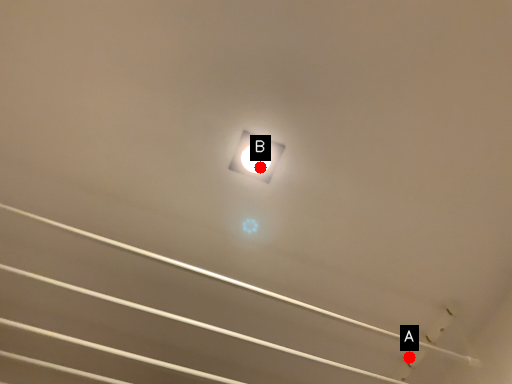
Question: Two points are circled on the image, labeled by A and B beside each circle. Which point is farther from the camera taking this photo?

Choices:
 (A) A is further
 (B) B is further

Answer: (A)